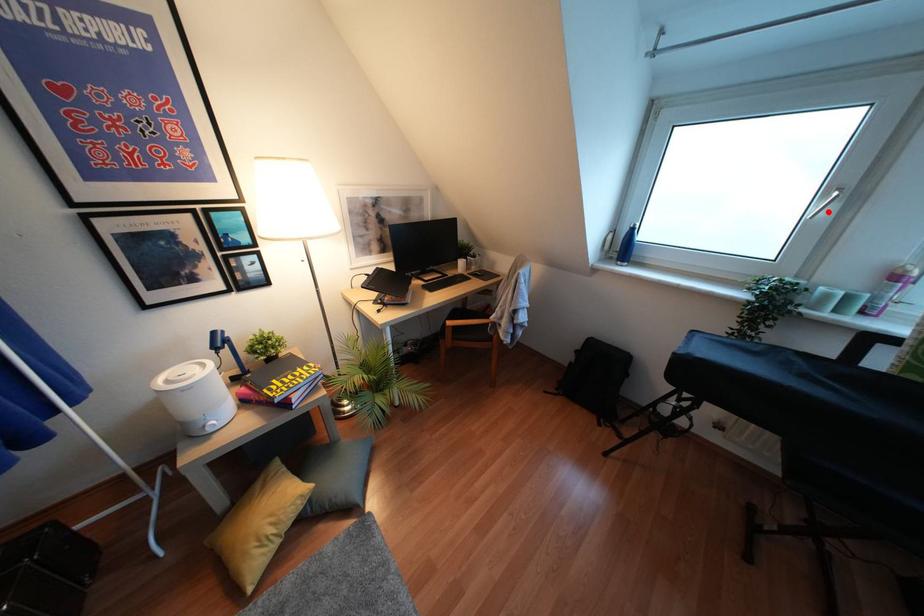
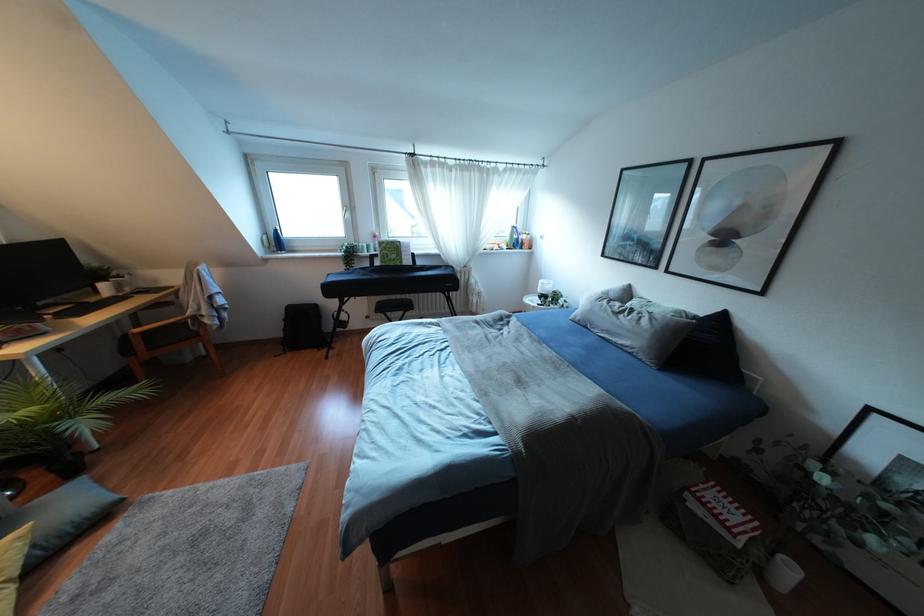
The point at the highlighted location is marked in the first image. Where is the corresponding point in the second image?

(346, 215)